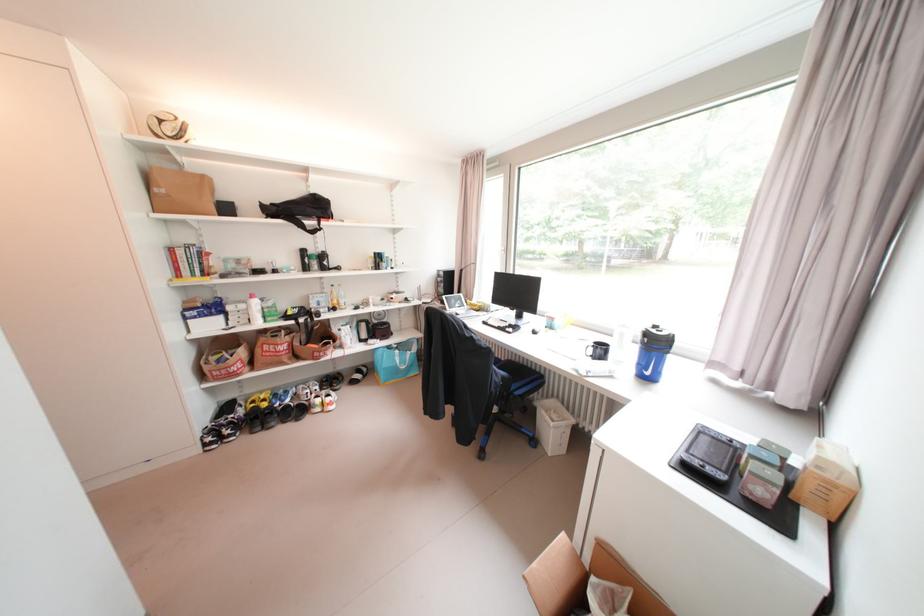
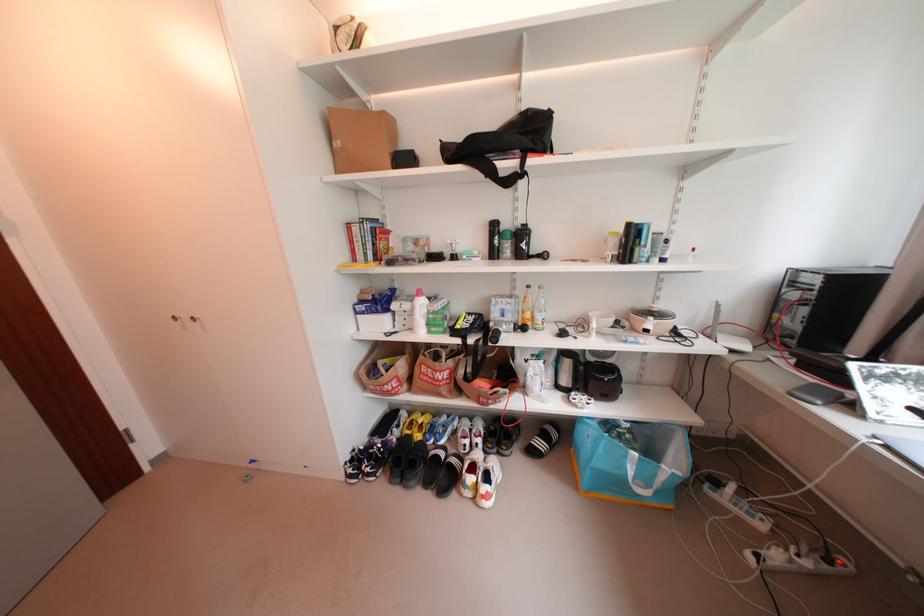
In the second image, find the point that corresponds to point (403, 357) in the first image.

(634, 458)